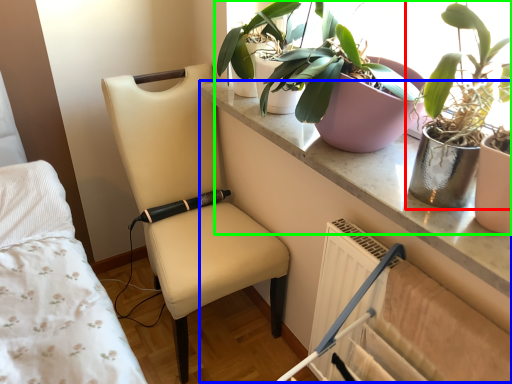
Question: Considering the real-world distances, which object is farthest from houseplant (highlighted by a red box)? table (highlighted by a blue box) or houseplant (highlighted by a green box)?

Choices:
 (A) table
 (B) houseplant

Answer: (A)